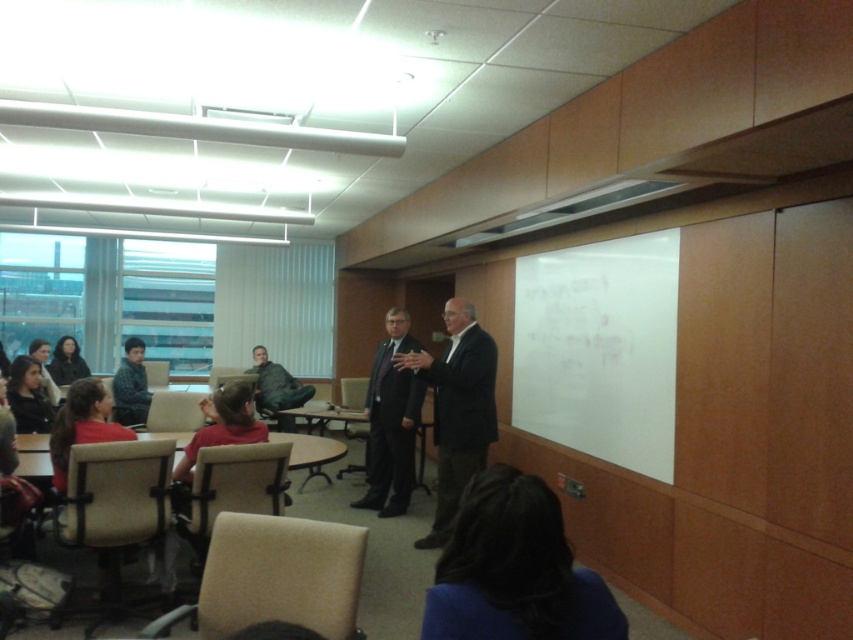
Question: Does dark suit at center appear on the right side of camouflage jacket at left?

Choices:
 (A) yes
 (B) no

Answer: (A)

Question: Does dark suit at center have a larger size compared to dark gray jacket at lower left?

Choices:
 (A) yes
 (B) no

Answer: (A)

Question: Based on their relative distances, which object is nearer to the dark suit at center?

Choices:
 (A) dark brown hair at lower center
 (B) camouflage jacket at left
 (C) dark gray jacket at lower left

Answer: (B)

Question: Which of these objects is positioned farthest from the dark suit at center?

Choices:
 (A) dark gray suit at center
 (B) dark gray jacket at lower left
 (C) dark brown hair at lower center

Answer: (B)

Question: Is dark gray suit at center above camouflage jacket at left?

Choices:
 (A) yes
 (B) no

Answer: (B)

Question: Which of these objects is positioned farthest from the camouflage jacket at left?

Choices:
 (A) dark suit at center
 (B) dark gray suit at center
 (C) dark gray fabric jacket at center

Answer: (A)